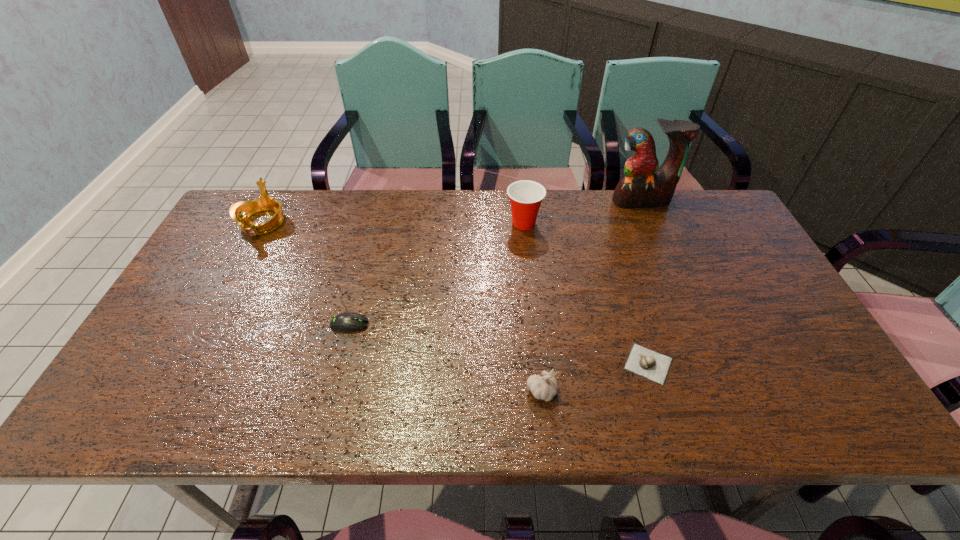
Identify the location of object located in the right edge section of the desktop. The height and width of the screenshot is (540, 960). (644, 184).

The image size is (960, 540). Find the location of `object positioned at the far left corner`. object positioned at the far left corner is located at coordinates (240, 211).

At what (x,y) coordinates should I click in order to perform the action: click on object at the far right corner. Please return your answer as a coordinate pair (x, y). The height and width of the screenshot is (540, 960). Looking at the image, I should click on (644, 184).

The image size is (960, 540). In the image, there is a desktop. What are the coordinates of `vacant region at the far edge` in the screenshot? It's located at (332, 200).

Image resolution: width=960 pixels, height=540 pixels. In the image, there is a desktop. Find the location of `free space at the near edge`. free space at the near edge is located at coordinates (469, 397).

This screenshot has width=960, height=540. Find the location of `free region at the left edge`. free region at the left edge is located at coordinates (176, 351).

At what (x,y) coordinates should I click in order to perform the action: click on free location at the right edge. Please return your answer as a coordinate pair (x, y). Looking at the image, I should click on (750, 343).

In the image, there is a desktop. Where is `free region at the far left corner`? Image resolution: width=960 pixels, height=540 pixels. free region at the far left corner is located at coordinates (247, 190).

The width and height of the screenshot is (960, 540). What are the coordinates of `vacant area at the near left corner` in the screenshot? It's located at (x=123, y=415).

In the image, there is a desktop. At what (x,y) coordinates should I click in order to perform the action: click on vacant space at the far right corner. Please return your answer as a coordinate pair (x, y). Looking at the image, I should click on (709, 190).